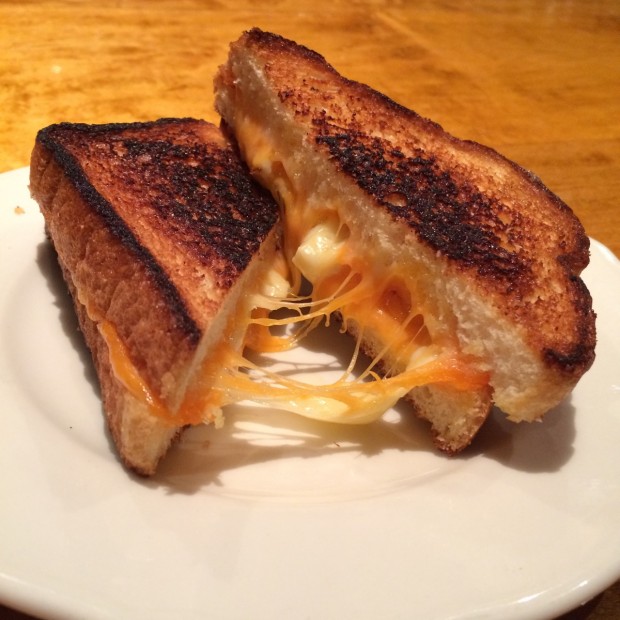
Identify the location of plate porcelain. The height and width of the screenshot is (620, 620). (392, 533).